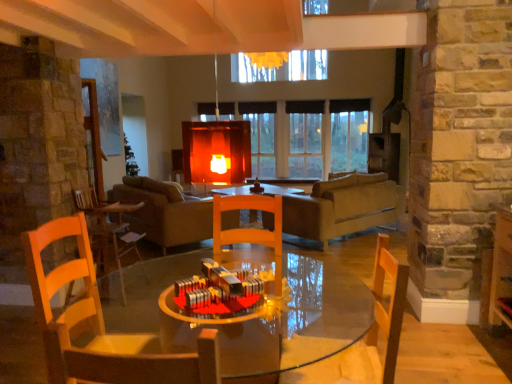
Question: Considering the positions of point (259, 102) and point (344, 196), is point (259, 102) closer or farther from the camera than point (344, 196)?

Choices:
 (A) closer
 (B) farther

Answer: (B)

Question: In the image, is transparent glass window at center on the left side or the right side of matte gray couch at center?

Choices:
 (A) right
 (B) left

Answer: (B)

Question: Which is farther from the leather couch at center?

Choices:
 (A) wooden chair at center, acting as the second chair starting from the back
 (B) transparent glass table at center
 (C) matte gray couch at center
 (D) wooden chair at center, placed as the second chair when sorted from left to right
 (E) wooden chair at left, arranged as the third chair when viewed from the right

Answer: (A)

Question: Estimate the real-world distances between objects in this image. Which object is closer to the transparent glass window at center?

Choices:
 (A) wooden chair at center, which appears as the 2th chair when viewed from the front
 (B) wooden chair at left, which is the 3th chair in front-to-back order
 (C) matte gray couch at center
 (D) leather couch at center
 (E) transparent glass table at center

Answer: (C)